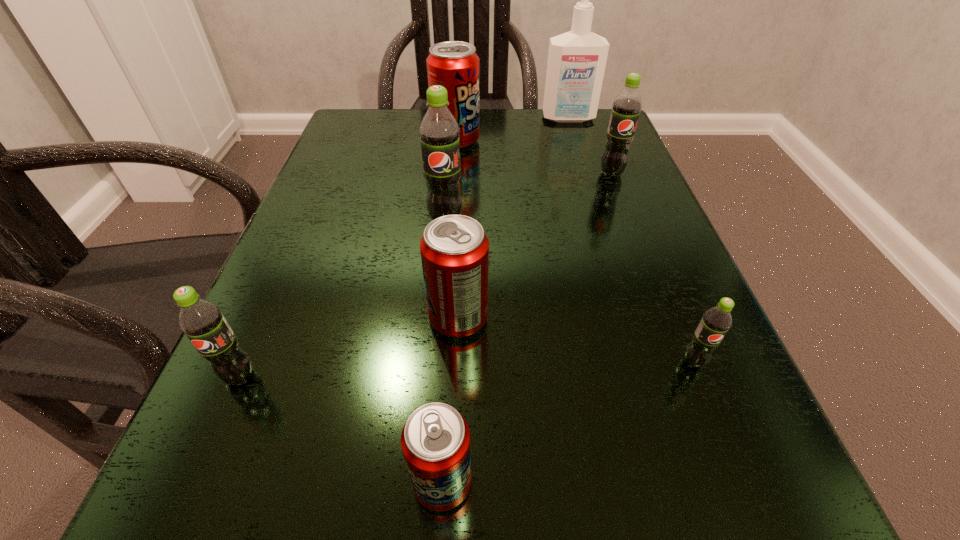
You are a GUI agent. You are given a task and a screenshot of the screen. Output one action in this format:
    pyautogui.click(x=<x>, y=<y>)
    Task: Click on the free space that satisfies the following two spatial constraints: 1. on the front label of the seventh shortest object; 2. on the left side of the second farthest red soda can
    
    Given the screenshot: What is the action you would take?
    point(437,319)